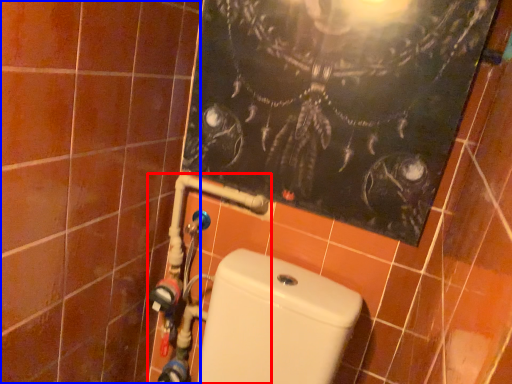
Question: Which of the following is the closest to the observer, water pipe (highlighted by a red box) or ceramic tile (highlighted by a blue box)?

Choices:
 (A) water pipe
 (B) ceramic tile

Answer: (B)